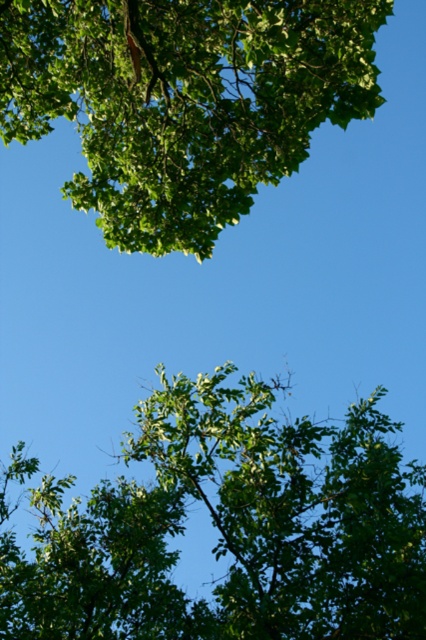
Question: Which point is closer to the camera taking this photo?

Choices:
 (A) (140, 113)
 (B) (276, 458)

Answer: (B)

Question: Which of the following is the closest to the observer?

Choices:
 (A) (420, 500)
 (B) (52, 3)

Answer: (B)

Question: Does green leafy tree at upper center have a smaller size compared to green leafy tree at upper left?

Choices:
 (A) yes
 (B) no

Answer: (A)

Question: Is the position of green leafy tree at upper center more distant than that of green leafy tree at upper left?

Choices:
 (A) no
 (B) yes

Answer: (B)

Question: Among these objects, which one is farthest from the camera?

Choices:
 (A) green leafy tree at upper center
 (B) green leafy tree at upper left

Answer: (A)

Question: From the image, what is the correct spatial relationship of green leafy tree at upper center in relation to green leafy tree at upper left?

Choices:
 (A) left
 (B) right

Answer: (A)